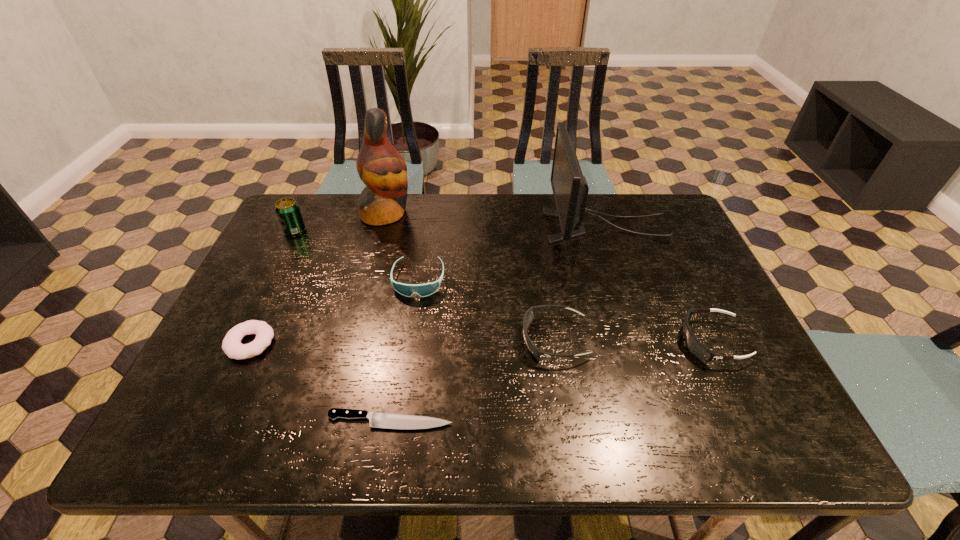
Where is `vacant region between the computer monitor and the tallest object`? This screenshot has height=540, width=960. vacant region between the computer monitor and the tallest object is located at coordinates (495, 220).

Identify the location of free space between the shortest object and the fourth farthest object. Image resolution: width=960 pixels, height=540 pixels. pyautogui.click(x=404, y=350).

At what (x,y) coordinates should I click in order to perform the action: click on vacant space in between the nearest object and the second shortest object. Please return your answer as a coordinate pair (x, y). This screenshot has height=540, width=960. Looking at the image, I should click on (321, 382).

The height and width of the screenshot is (540, 960). I want to click on free space between the second goggles from right to left and the computer monitor, so click(x=580, y=283).

At what (x,y) coordinates should I click in order to perform the action: click on free space between the fourth farthest object and the steak knife. Please return your answer as a coordinate pair (x, y). Looking at the image, I should click on (404, 350).

At what (x,y) coordinates should I click in order to perform the action: click on empty space between the leftmost goggles and the tallest object. Please return your answer as a coordinate pair (x, y). The width and height of the screenshot is (960, 540). Looking at the image, I should click on (402, 247).

Image resolution: width=960 pixels, height=540 pixels. Identify the location of empty space between the second goggles from left to right and the steak knife. (472, 380).

Locate which object is the third closest to the parrot. Please provide its 2D coordinates. Your answer should be formatted as a tuple, i.e. [(x, y)], where the tuple contains the x and y coordinates of a point satisfying the conditions above.

[(231, 345)]

What are the coordinates of `the closest object to the farthest goggles` in the screenshot? It's located at pyautogui.click(x=380, y=166).

Identify which goggles is located as the second nearest to the second tallest object. Please provide its 2D coordinates. Your answer should be formatted as a tuple, i.e. [(x, y)], where the tuple contains the x and y coordinates of a point satisfying the conditions above.

[(693, 344)]